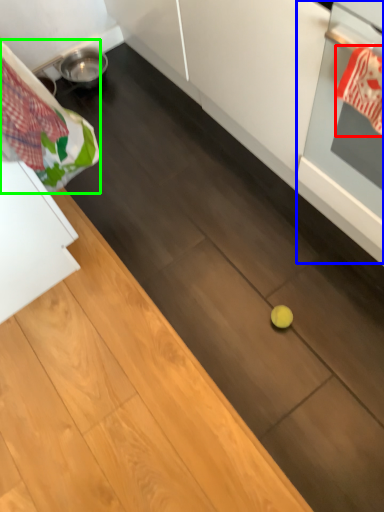
Question: Considering the real-world distances, which object is closest to material (highlighted by a red box)? oven (highlighted by a blue box) or laundry (highlighted by a green box).

Choices:
 (A) oven
 (B) laundry

Answer: (A)